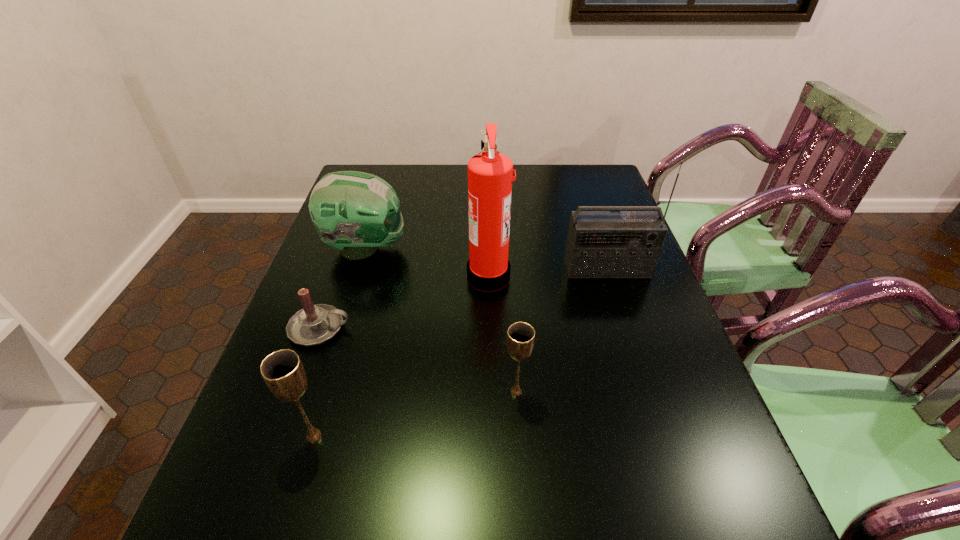
The image size is (960, 540). I want to click on candle that is positioned at the left edge, so click(314, 324).

Locate an element on the screen. Image resolution: width=960 pixels, height=540 pixels. football helmet that is positioned at the left edge is located at coordinates (355, 212).

Locate an element on the screen. Image resolution: width=960 pixels, height=540 pixels. object present at the right edge is located at coordinates (601, 244).

Where is `object positioned at the near left corner`? object positioned at the near left corner is located at coordinates 283,372.

The image size is (960, 540). Find the location of `vacant region at the far edge of the desktop`. vacant region at the far edge of the desktop is located at coordinates (423, 179).

Find the location of a particular element. This screenshot has height=540, width=960. vacant space at the near edge of the desktop is located at coordinates (430, 444).

Locate an element on the screen. The height and width of the screenshot is (540, 960). vacant region at the left edge of the desktop is located at coordinates (324, 249).

This screenshot has height=540, width=960. In the image, there is a desktop. What are the coordinates of `vacant space at the far right corner` in the screenshot? It's located at (567, 168).

You are a GUI agent. You are given a task and a screenshot of the screen. Output one action in this format:
    pyautogui.click(x=<x>, y=<y>)
    Task: Click on the free spot at the near right corner of the desktop
    The height and width of the screenshot is (540, 960).
    Given the screenshot: What is the action you would take?
    pyautogui.click(x=669, y=435)

You are a GUI agent. You are given a task and a screenshot of the screen. Output one action in this format:
    pyautogui.click(x=<x>, y=<y>)
    Task: Click on the vacant area between the second shortest object and the taller chalice
    The width and height of the screenshot is (960, 540).
    Given the screenshot: What is the action you would take?
    pyautogui.click(x=415, y=414)